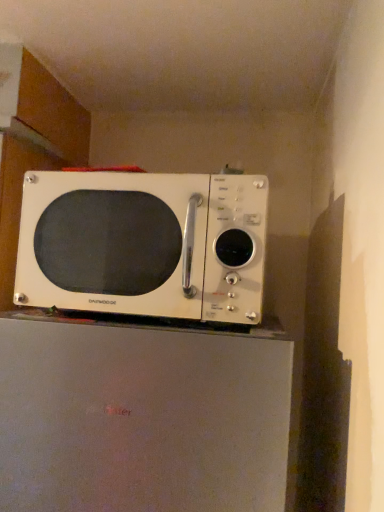
Describe the element at coordinates (144, 244) in the screenshot. I see `white matte microwave at upper center` at that location.

Where is `white matte microwave at upper center`? The width and height of the screenshot is (384, 512). white matte microwave at upper center is located at coordinates click(144, 244).

Describe the element at coordinates (141, 418) in the screenshot. Image resolution: width=384 pixels, height=512 pixels. I see `white matte microwave at upper center` at that location.

This screenshot has width=384, height=512. In order to click on white matte microwave at upper center in this screenshot , I will do `click(141, 418)`.

Identify the location of white matte microwave at upper center. This screenshot has height=512, width=384. (144, 244).

Considering the positions of objects white matte microwave at upper center and white matte microwave at upper center in the image provided, who is more to the left, white matte microwave at upper center or white matte microwave at upper center?

Positioned to the left is white matte microwave at upper center.

From the picture: Between white matte microwave at upper center and white matte microwave at upper center, which one is positioned in front?

white matte microwave at upper center is in front.

Considering the positions of point (38, 465) and point (132, 306), is point (38, 465) closer or farther from the camera than point (132, 306)?

Point (38, 465) is positioned closer to the camera compared to point (132, 306).

Based on the photo, from the image's perspective, is white matte microwave at upper center over white matte microwave at upper center?

No, from the image's perspective, white matte microwave at upper center is not on top of white matte microwave at upper center.

From a real-world perspective, between white matte microwave at upper center and white matte microwave at upper center, who is vertically lower?

In real-world perspective, white matte microwave at upper center is lower.

Consider the image. Which object is thinner, white matte microwave at upper center or white matte microwave at upper center?

With smaller width is white matte microwave at upper center.

In terms of height, does white matte microwave at upper center look taller or shorter compared to white matte microwave at upper center?

Clearly, white matte microwave at upper center is taller compared to white matte microwave at upper center.

Which of these two, white matte microwave at upper center or white matte microwave at upper center, is bigger?

Bigger between the two is white matte microwave at upper center.

Which is correct: white matte microwave at upper center is inside white matte microwave at upper center, or outside of it?

white matte microwave at upper center cannot be found inside white matte microwave at upper center.

Is white matte microwave at upper center next to white matte microwave at upper center and touching it?

white matte microwave at upper center and white matte microwave at upper center are clearly separated.

Is white matte microwave at upper center facing away from white matte microwave at upper center?

No, white matte microwave at upper center is not facing away from white matte microwave at upper center.

Can you tell me how much white matte microwave at upper center and white matte microwave at upper center differ in facing direction?

The angle between the facing direction of white matte microwave at upper center and the facing direction of white matte microwave at upper center is 2.64 degrees.

What are the coordinates of `microwave oven that is on the right side of white matte microwave at upper center` in the screenshot? It's located at (144, 244).

Considering the positions of objects white matte microwave at upper center and white matte microwave at upper center in the image provided, who is more to the left, white matte microwave at upper center or white matte microwave at upper center?

white matte microwave at upper center is more to the left.

Considering the relative positions of white matte microwave at upper center and white matte microwave at upper center in the image provided, is white matte microwave at upper center in front of white matte microwave at upper center?

No, white matte microwave at upper center is further to the viewer.

Is point (74, 250) closer to camera compared to point (269, 367)?

No, it is behind (269, 367).

From the image's perspective, who appears lower, white matte microwave at upper center or white matte microwave at upper center?

white matte microwave at upper center, from the image's perspective.

From a real-world perspective, is white matte microwave at upper center physically located above or below white matte microwave at upper center?

In terms of real-world spatial position, white matte microwave at upper center is above white matte microwave at upper center.

Is white matte microwave at upper center wider than white matte microwave at upper center?

No, white matte microwave at upper center is not wider than white matte microwave at upper center.

Considering the sizes of white matte microwave at upper center and white matte microwave at upper center in the image, is white matte microwave at upper center taller or shorter than white matte microwave at upper center?

white matte microwave at upper center is shorter than white matte microwave at upper center.

Can you confirm if white matte microwave at upper center is bigger than white matte microwave at upper center?

Actually, white matte microwave at upper center might be smaller than white matte microwave at upper center.

Do you think white matte microwave at upper center is within white matte microwave at upper center, or outside of it?

The correct answer is: outside.

Is white matte microwave at upper center directly adjacent to white matte microwave at upper center?

No, white matte microwave at upper center is not next to white matte microwave at upper center.

Based on the photo, does white matte microwave at upper center turn towards white matte microwave at upper center?

No, white matte microwave at upper center does not turn towards white matte microwave at upper center.

How different are the orientations of white matte microwave at upper center and white matte microwave at upper center in degrees?

The angular difference between white matte microwave at upper center and white matte microwave at upper center is 2.64 degrees.

Find the location of `appliance below the white matte microwave at upper center (from the image's perspective)`. appliance below the white matte microwave at upper center (from the image's perspective) is located at coordinates (141, 418).

The width and height of the screenshot is (384, 512). Find the location of `microwave oven above the white matte microwave at upper center (from the image's perspective)`. microwave oven above the white matte microwave at upper center (from the image's perspective) is located at coordinates (144, 244).

At what (x,y) coordinates should I click in order to perform the action: click on microwave oven behind the white matte microwave at upper center. Please return your answer as a coordinate pair (x, y). Looking at the image, I should click on (144, 244).